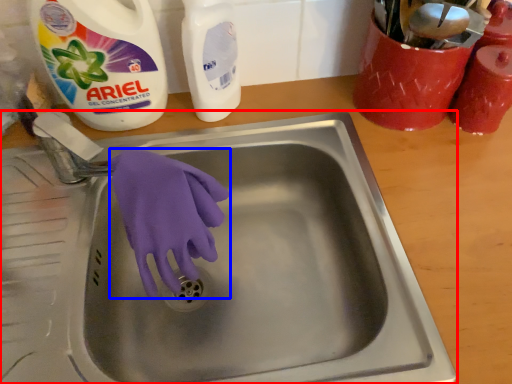
Question: Which of the following is the farthest to the observer, sink (highlighted by a red box) or glove (highlighted by a blue box)?

Choices:
 (A) sink
 (B) glove

Answer: (B)